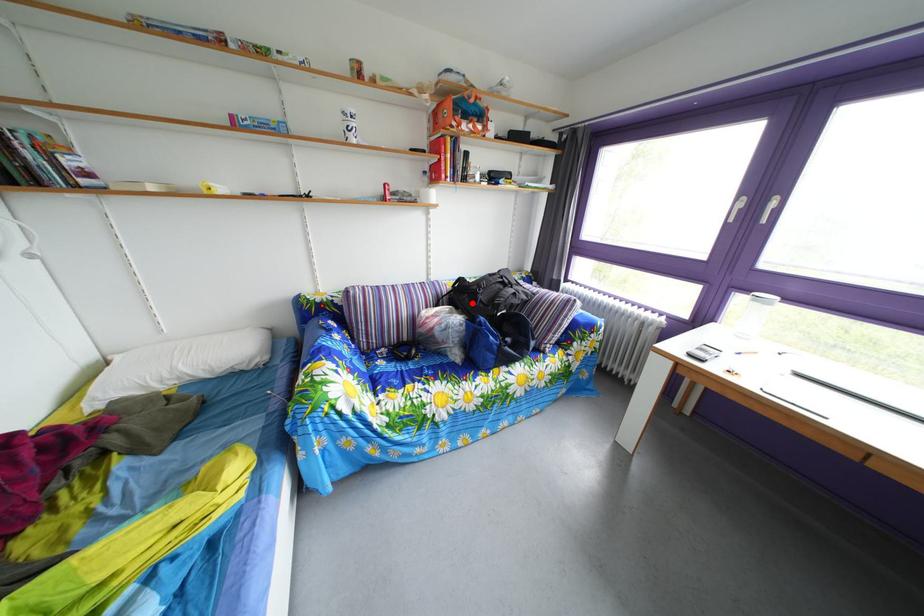
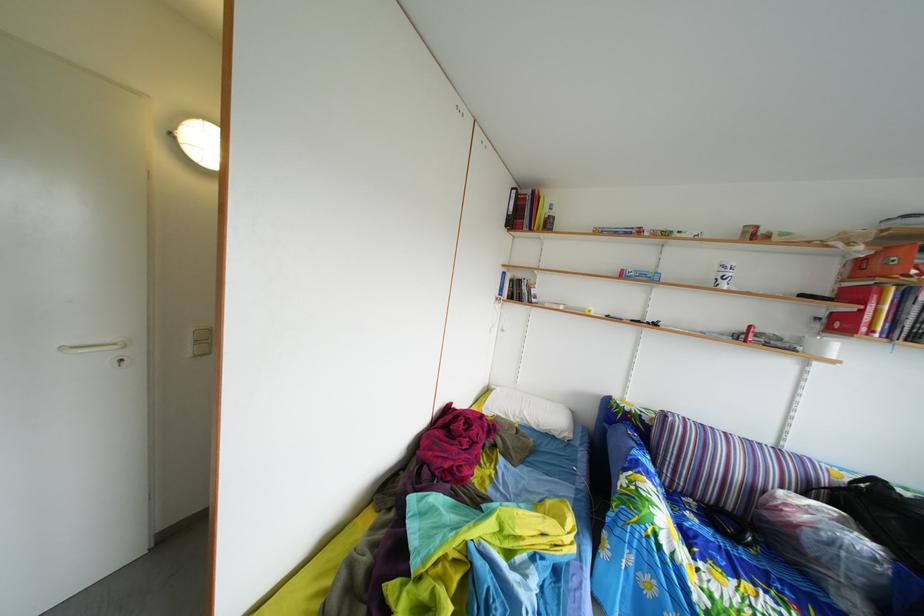
Locate, in the second image, the point that corresponds to the highlighted location in the first image.

(886, 515)